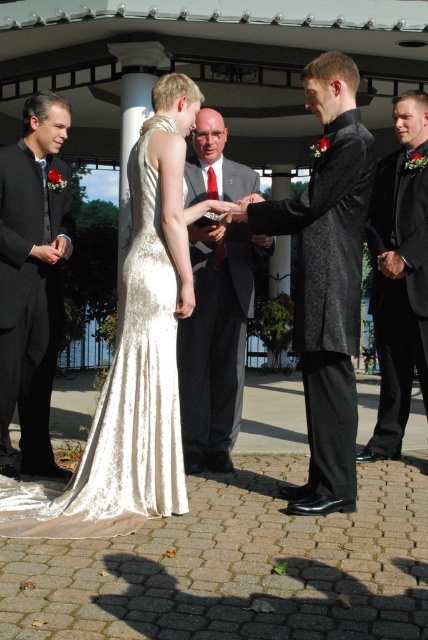
Question: Which point is farther to the camera?

Choices:
 (A) (39, 497)
 (B) (353, 300)

Answer: (A)

Question: Observing the image, what is the correct spatial positioning of ivory satin dress at center in reference to shiny black suit at center?

Choices:
 (A) below
 (B) above

Answer: (A)

Question: Can you confirm if ivory satin dress at center is positioned above matte black suit at left?

Choices:
 (A) yes
 (B) no

Answer: (B)

Question: Which object is farther from the camera taking this photo?

Choices:
 (A) matte black suit at left
 (B) matte gray suit at center
 (C) black satin tuxedo at right
 (D) shiny black suit at center

Answer: (C)

Question: Where is ivory satin dress at center located in relation to black satin tuxedo at right in the image?

Choices:
 (A) left
 (B) right

Answer: (A)

Question: Among these points, which one is nearest to the camera?

Choices:
 (A) (x=318, y=205)
 (B) (x=136, y=476)

Answer: (B)